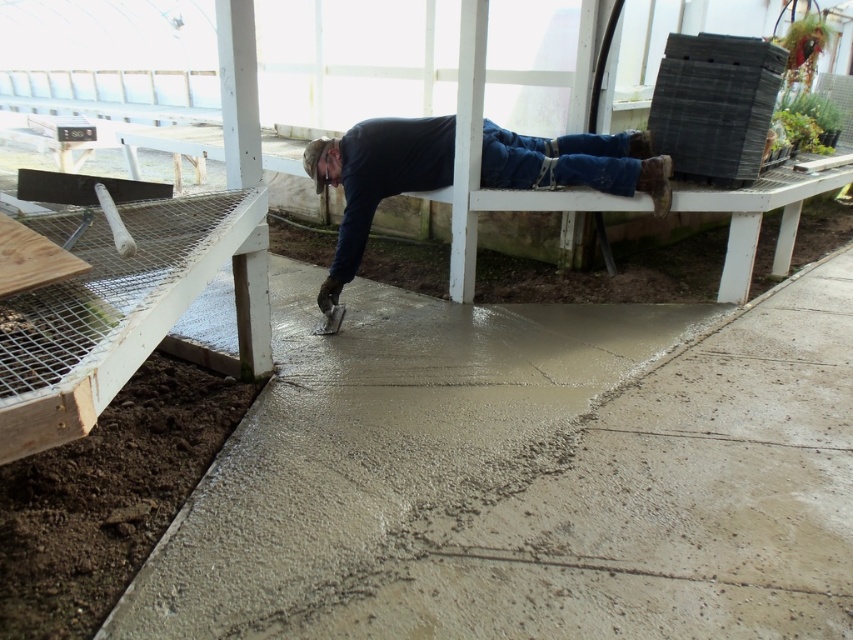
Question: Based on their relative distances, which object is farther from the blue denim jeans at upper center?

Choices:
 (A) smooth concrete at center
 (B) brown soil at lower left

Answer: (B)

Question: Can you confirm if smooth concrete at center is thinner than blue denim jeans at upper center?

Choices:
 (A) no
 (B) yes

Answer: (A)

Question: Which point is closer to the camera?

Choices:
 (A) (660, 212)
 (B) (383, 580)

Answer: (B)

Question: Considering the relative positions of smooth concrete at center and blue denim jeans at upper center in the image provided, where is smooth concrete at center located with respect to blue denim jeans at upper center?

Choices:
 (A) above
 (B) below

Answer: (B)

Question: Can you confirm if brown soil at lower left is positioned to the left of blue denim jeans at upper center?

Choices:
 (A) no
 (B) yes

Answer: (B)

Question: Among these points, which one is farthest from the camera?

Choices:
 (A) (122, 480)
 (B) (766, 620)
 (C) (399, 188)

Answer: (C)